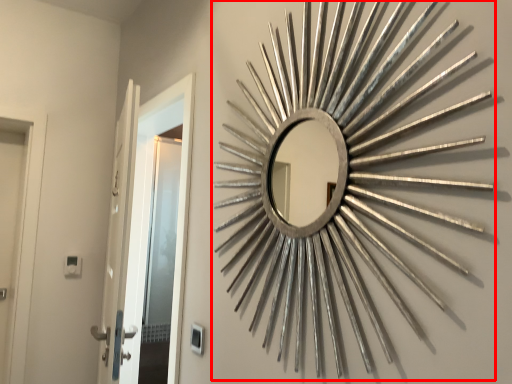
Question: From the image's perspective, where is brass (annotated by the red box) located relative to door?

Choices:
 (A) above
 (B) below

Answer: (A)